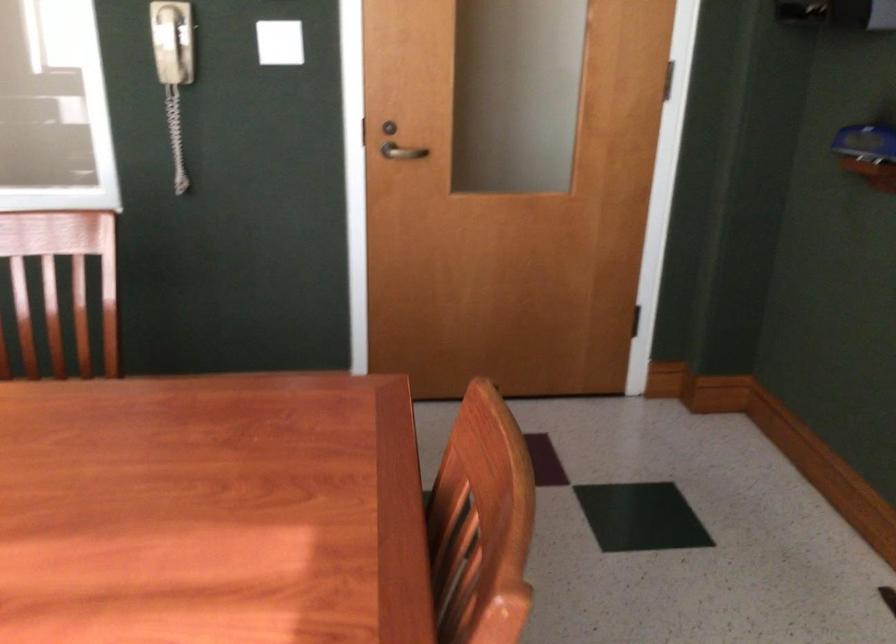
Where is `white phone handset`? white phone handset is located at coordinates (171, 41).